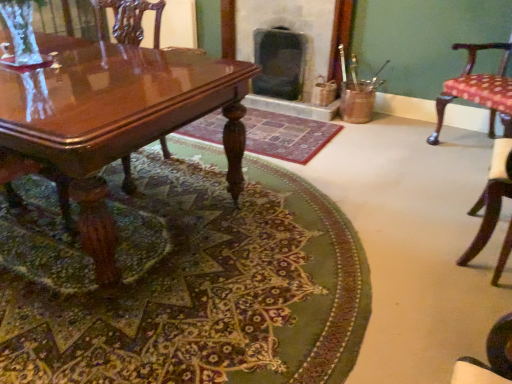
At what (x,y) coordinates should I click in order to perform the action: click on vacant space behind patterned fabric cushion at right, which appears as the 2th chair when viewed from the left. Please return your answer as a coordinate pair (x, y). The image size is (512, 384). Looking at the image, I should click on (442, 204).